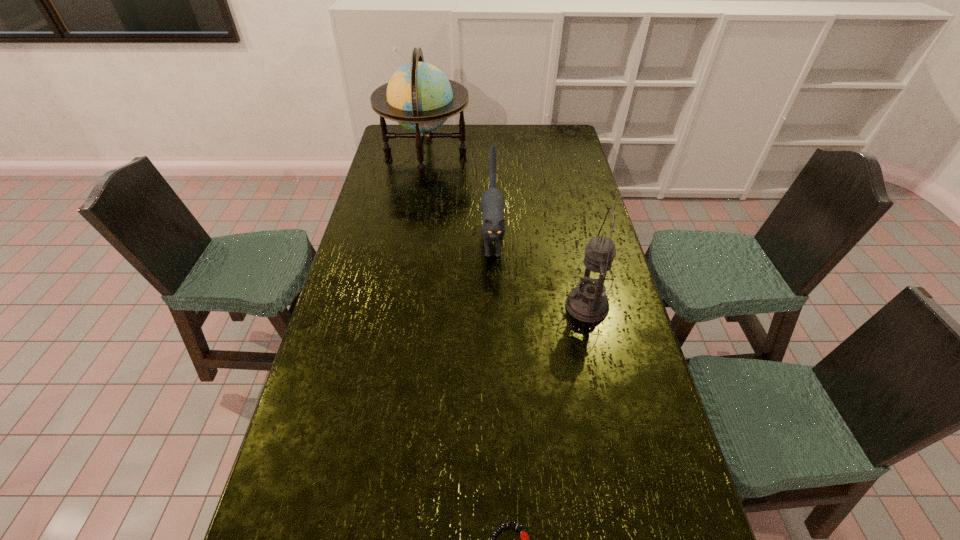
Locate an element on the screen. The image size is (960, 540). the leftmost object is located at coordinates (419, 96).

Locate an element on the screen. This screenshot has height=540, width=960. the farthest object is located at coordinates (419, 96).

What are the coordinates of `oil lamp` in the screenshot? It's located at (588, 302).

This screenshot has height=540, width=960. I want to click on the third farthest object, so click(588, 302).

The image size is (960, 540). Find the location of `the second farthest object`. the second farthest object is located at coordinates (492, 202).

Identify the location of cat. (492, 202).

Find the location of a particular element. free space located on the surface of the farthest object is located at coordinates (485, 154).

This screenshot has height=540, width=960. What are the coordinates of `vacant point located 0.260m on the front of the oil lamp` in the screenshot? It's located at (610, 403).

Where is `free point located 0.180m at the face of the second shortest object`? free point located 0.180m at the face of the second shortest object is located at coordinates (494, 313).

Where is `object located in the far edge section of the desktop`? Image resolution: width=960 pixels, height=540 pixels. object located in the far edge section of the desktop is located at coordinates (419, 96).